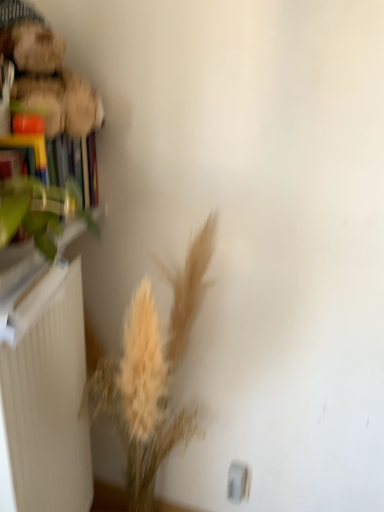
Question: Could you tell me if light beige dried grass at lower left is turned towards hardcover book at left?

Choices:
 (A) no
 (B) yes

Answer: (A)

Question: From a real-world perspective, is light beige dried grass at lower left below hardcover book at left?

Choices:
 (A) no
 (B) yes

Answer: (B)

Question: Does light beige dried grass at lower left have a lesser height compared to hardcover book at left?

Choices:
 (A) no
 (B) yes

Answer: (A)

Question: Can you confirm if light beige dried grass at lower left is thinner than hardcover book at left?

Choices:
 (A) yes
 (B) no

Answer: (B)

Question: Is light beige dried grass at lower left in front of hardcover book at left?

Choices:
 (A) yes
 (B) no

Answer: (A)

Question: Can you confirm if light beige dried grass at lower left is taller than hardcover book at left?

Choices:
 (A) no
 (B) yes

Answer: (B)

Question: Is white matte radiator at left not close to hardcover book at left?

Choices:
 (A) yes
 (B) no

Answer: (B)

Question: From the image's perspective, would you say white matte radiator at left is shown under hardcover book at left?

Choices:
 (A) yes
 (B) no

Answer: (A)

Question: From a real-world perspective, is white matte radiator at left physically above hardcover book at left?

Choices:
 (A) yes
 (B) no

Answer: (B)

Question: Is white matte radiator at left positioned with its back to hardcover book at left?

Choices:
 (A) no
 (B) yes

Answer: (A)

Question: Is white matte radiator at left taller than hardcover book at left?

Choices:
 (A) no
 (B) yes

Answer: (B)

Question: Is the position of white matte radiator at left more distant than that of hardcover book at left?

Choices:
 (A) yes
 (B) no

Answer: (B)

Question: Does white matte radiator at left lie behind light beige dried grass at lower left?

Choices:
 (A) no
 (B) yes

Answer: (B)